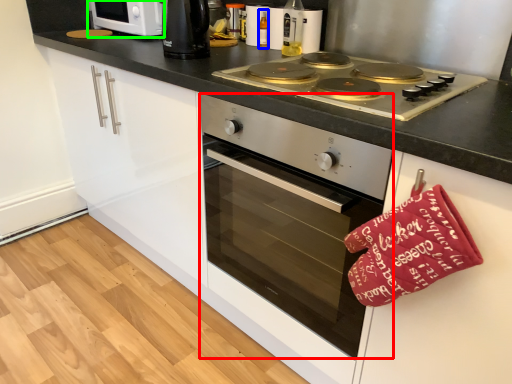
Question: Which is nearer to the oven (highlighted by a red box)? bottle (highlighted by a blue box) or home appliance (highlighted by a green box).

Choices:
 (A) bottle
 (B) home appliance

Answer: (A)